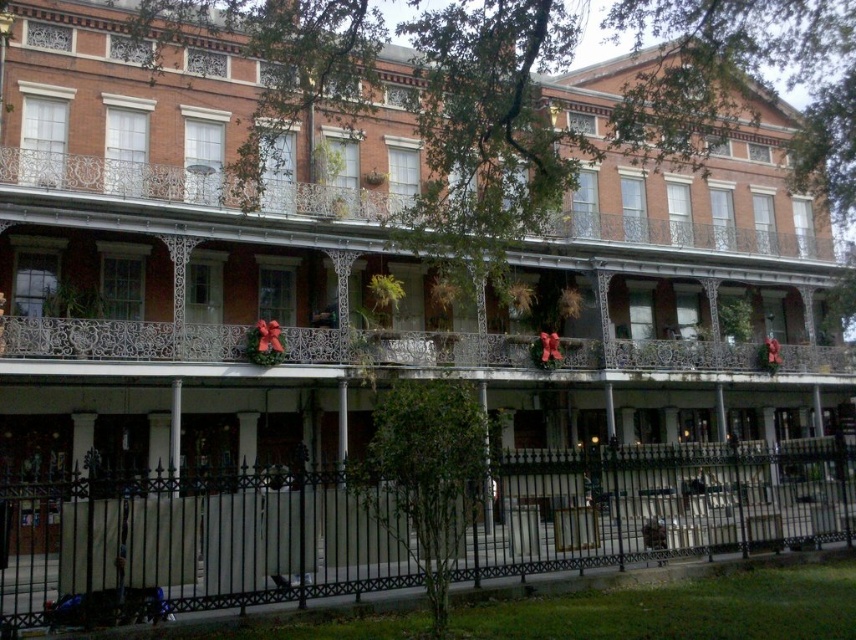
Between iron/black fence at lower center and metallic wrought iron balcony at center, which one appears on the left side from the viewer's perspective?

Positioned to the left is iron/black fence at lower center.

In the scene shown: Who is more forward, [339,589] or [340,195]?

Point [339,589] is more forward.

Does point (229, 502) come in front of point (667, 186)?

That is True.

Locate an element on the screen. Image resolution: width=856 pixels, height=640 pixels. iron/black fence at lower center is located at coordinates (198, 540).